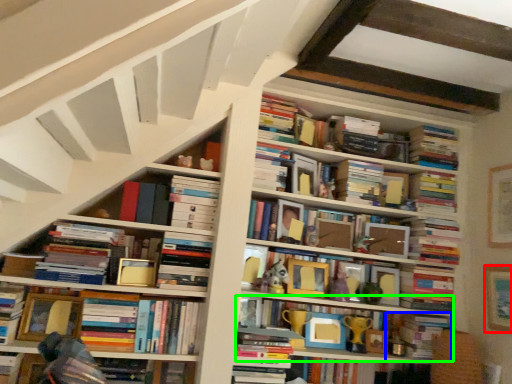
Question: Based on their relative distances, which object is farther from picture frame (highlighted by a red box)? Choose from book (highlighted by a blue box) and book (highlighted by a green box).

Choices:
 (A) book
 (B) book

Answer: (B)